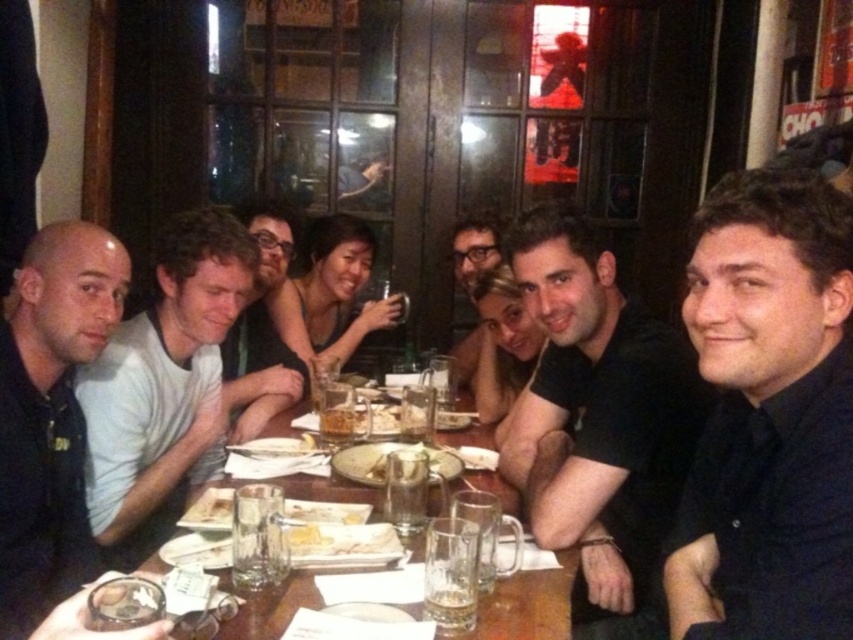
Does point (722, 184) come behind point (42, 538)?

That is False.

Is dark blue shirt at center shorter than black matte shirt at left?

Yes.

Image resolution: width=853 pixels, height=640 pixels. Find the location of `dark blue shirt at center`. dark blue shirt at center is located at coordinates (769, 416).

Is dark blue shirt at center above translucent glass mug at center?

Correct, dark blue shirt at center is located above translucent glass mug at center.

Is dark blue shirt at center to the left of translucent glass mug at center from the viewer's perspective?

No, dark blue shirt at center is not to the left of translucent glass mug at center.

Describe the element at coordinates (769, 416) in the screenshot. This screenshot has height=640, width=853. I see `dark blue shirt at center` at that location.

Locate an element on the screen. The height and width of the screenshot is (640, 853). dark blue shirt at center is located at coordinates (769, 416).

Can you confirm if dark blue shirt at center is positioned to the left of translucent glass beer at center?

No, dark blue shirt at center is not to the left of translucent glass beer at center.

Measure the distance between point [755,429] and camera.

Point [755,429] is 1.03 meters away from camera.

The image size is (853, 640). Describe the element at coordinates (769, 416) in the screenshot. I see `dark blue shirt at center` at that location.

Where is `dark blue shirt at center`? dark blue shirt at center is located at coordinates (769, 416).